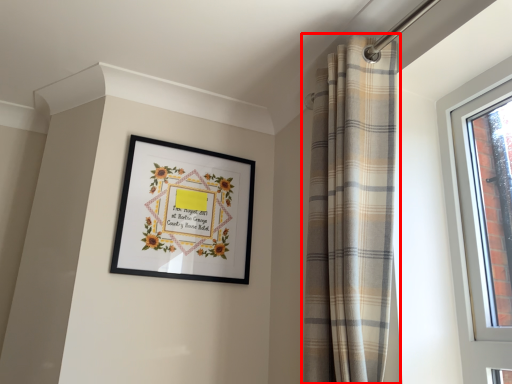
Question: From the image, what is the correct spatial relationship of curtain (annotated by the red box) in relation to picture frame?

Choices:
 (A) left
 (B) right

Answer: (B)